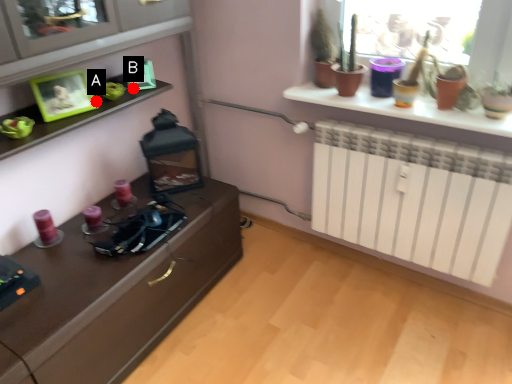
Question: Two points are circled on the image, labeled by A and B beside each circle. Which point appears farthest from the camera in this image?

Choices:
 (A) A is further
 (B) B is further

Answer: (B)